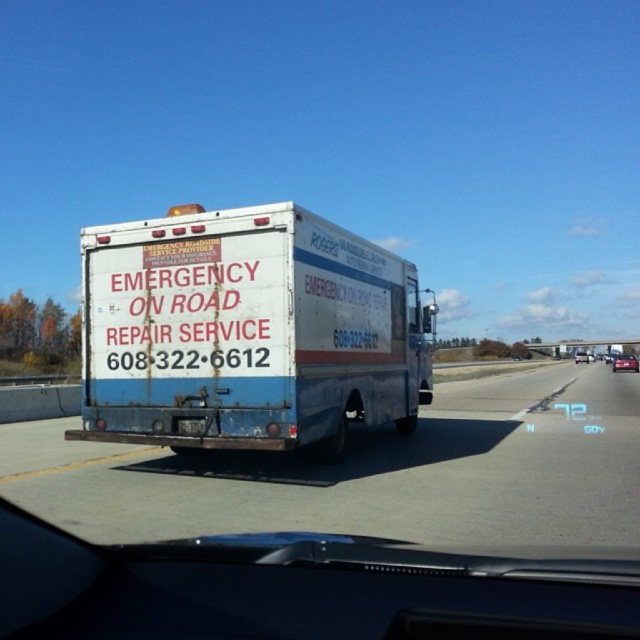
The image size is (640, 640). What are the coordinates of `rusty metal truck at center` in the screenshot? It's located at (376, 474).

Describe the element at coordinates (376, 474) in the screenshot. I see `rusty metal truck at center` at that location.

Who is more distant from viewer, (x=627, y=387) or (x=582, y=362)?

Point (x=582, y=362)

I want to click on rusty metal truck at center, so 376,474.

Who is taller, white matte truck at center or rusty metal truck at center?

white matte truck at center

Who is shorter, white matte truck at center or rusty metal truck at center?

Standing shorter between the two is rusty metal truck at center.

Is point (314, 426) positioned behind point (264, 525)?

That is True.

Find the location of a particular element. The width and height of the screenshot is (640, 640). white matte truck at center is located at coordinates (246, 330).

Does rusty metal truck at center have a greater width compared to metallic red sedan at center?

In fact, rusty metal truck at center might be narrower than metallic red sedan at center.

Measure the distance from rusty metal truck at center to metallic red sedan at center.

A distance of 47.55 meters exists between rusty metal truck at center and metallic red sedan at center.

Which is behind, point (620, 410) or point (634, 365)?

Point (634, 365)

Locate an element on the screen. This screenshot has height=640, width=640. rusty metal truck at center is located at coordinates (376, 474).